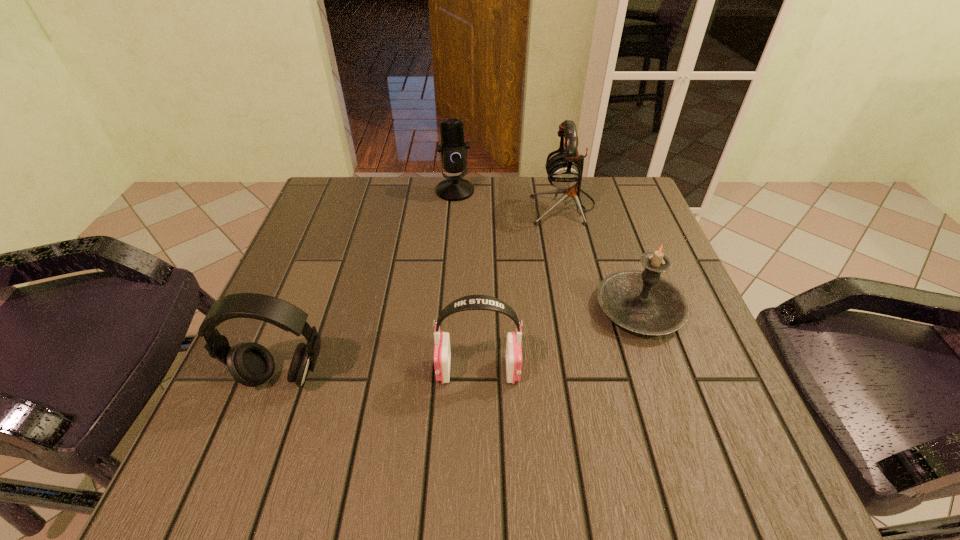
I want to click on the tallest object, so click(564, 169).

Identify the location of the farthest earphone. (564, 169).

The width and height of the screenshot is (960, 540). Identify the location of microphone. (453, 150).

You are a GUI agent. You are given a task and a screenshot of the screen. Output one action in this format:
    pyautogui.click(x=<x>, y=<y>)
    Task: Click on the leftmost object
    
    Given the screenshot: What is the action you would take?
    pyautogui.click(x=251, y=364)

Find the location of a particular element. the second earphone from left to right is located at coordinates (442, 355).

Where is `candle`? candle is located at coordinates (643, 302).

Where is `free spot located 0.060m on the front of the tallest object`? This screenshot has height=540, width=960. free spot located 0.060m on the front of the tallest object is located at coordinates (571, 241).

This screenshot has height=540, width=960. What are the coordinates of `free space located on the stand of the microphone` in the screenshot? It's located at (450, 253).

Find the location of a particular element. The height and width of the screenshot is (540, 960). free space located 0.110m on the ear cups of the leftmost earphone is located at coordinates (252, 460).

Image resolution: width=960 pixels, height=540 pixels. I want to click on blank space located on the outer surface of the second earphone from left to right, so click(608, 370).